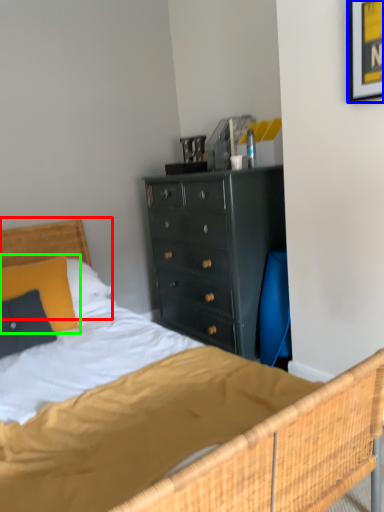
Question: Which is farther away from headboard (highlighted by a red box)? picture frame (highlighted by a blue box) or pillow (highlighted by a green box)?

Choices:
 (A) picture frame
 (B) pillow

Answer: (A)